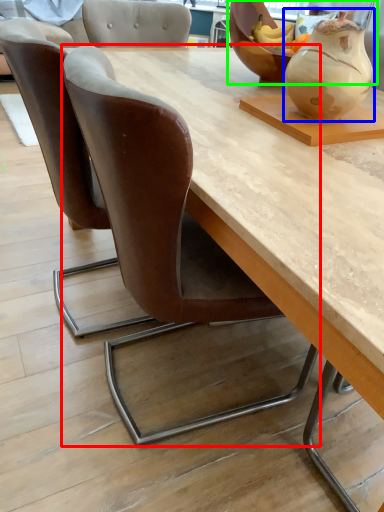
Question: Considering the real-world distances, which object is farthest from chair (highlighted by a red box)? vase (highlighted by a blue box) or bowl (highlighted by a green box)?

Choices:
 (A) vase
 (B) bowl

Answer: (B)